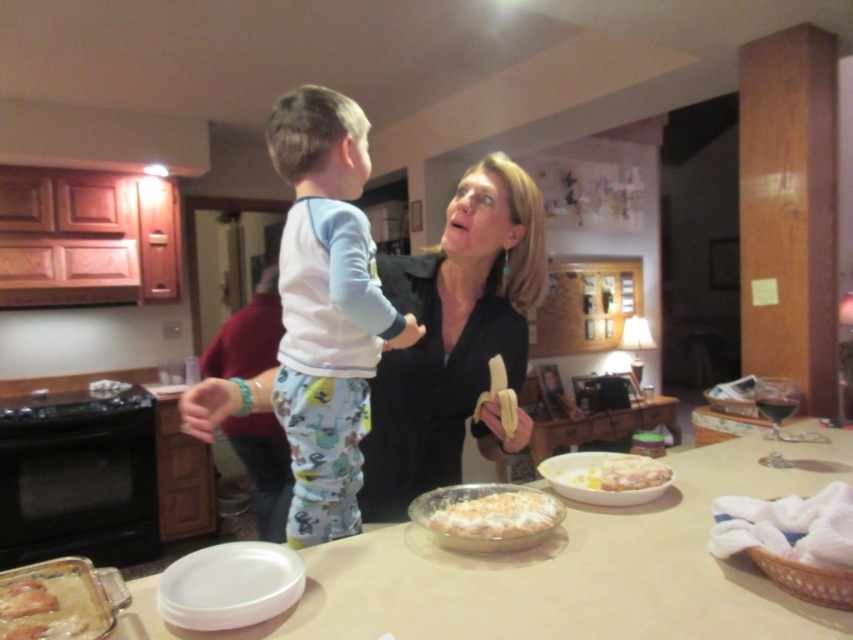
Question: Which point is farther from the camera taking this photo?

Choices:
 (A) (341, 292)
 (B) (456, 524)
 (C) (619, 465)
 (D) (445, 284)

Answer: (D)

Question: From the image, what is the correct spatial relationship of matte black shirt at center in relation to light blue cotton pajamas at center?

Choices:
 (A) above
 (B) below

Answer: (B)

Question: Can you confirm if light blue cotton pajamas at center is positioned to the right of white creamy pasta at center?

Choices:
 (A) no
 (B) yes

Answer: (A)

Question: Can you confirm if light blue cotton pajamas at center is thinner than white fluffy pie at center?

Choices:
 (A) yes
 (B) no

Answer: (B)

Question: Considering the real-world distances, which object is farthest from the white creamy pasta at center?

Choices:
 (A) white fluffy pie at center
 (B) matte black shirt at center
 (C) light blue cotton pajamas at center

Answer: (C)

Question: Which point appears closest to the camera in this image?

Choices:
 (A) (480, 344)
 (B) (486, 506)
 (C) (639, 476)

Answer: (B)